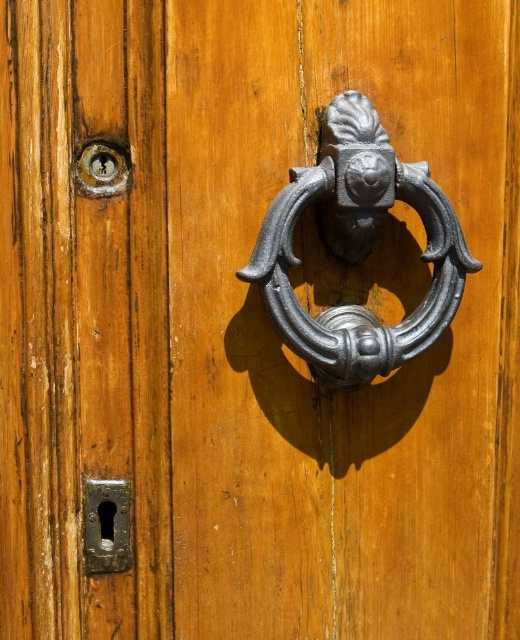
Question: Is polished silver knocker at center above dark gray metal keyhole at lower left?

Choices:
 (A) no
 (B) yes

Answer: (B)

Question: Which point is closer to the camera?

Choices:
 (A) polished silver knocker at center
 (B) dark gray metal keyhole at lower left

Answer: (A)

Question: Among these objects, which one is farthest from the camera?

Choices:
 (A) dark gray metal keyhole at lower left
 (B) polished silver knocker at center

Answer: (A)

Question: Which point is closer to the camera?

Choices:
 (A) dark gray metal keyhole at lower left
 (B) polished silver knocker at center

Answer: (B)

Question: Is polished silver knocker at center to the right of dark gray metal keyhole at lower left from the viewer's perspective?

Choices:
 (A) no
 (B) yes

Answer: (B)

Question: Can you confirm if polished silver knocker at center is positioned below dark gray metal keyhole at lower left?

Choices:
 (A) yes
 (B) no

Answer: (B)